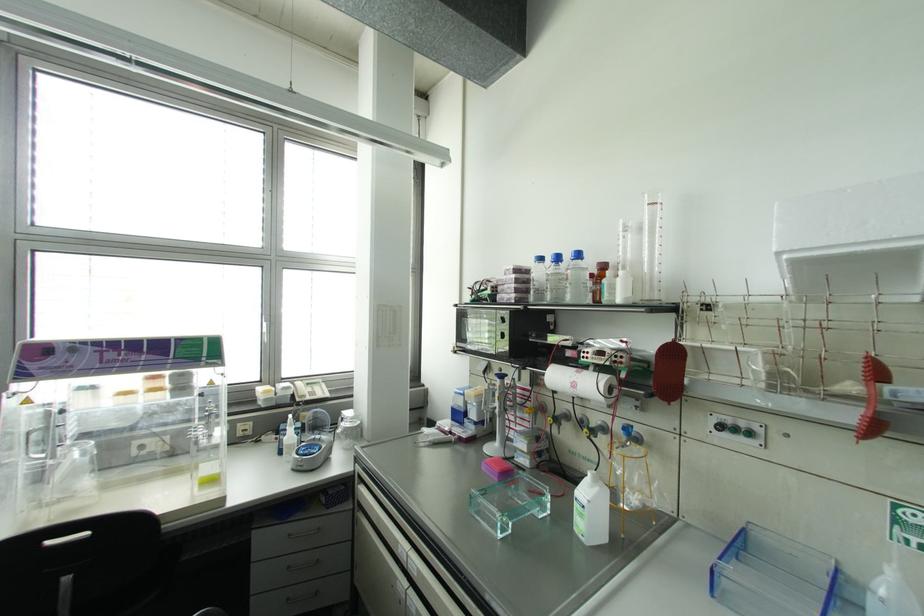
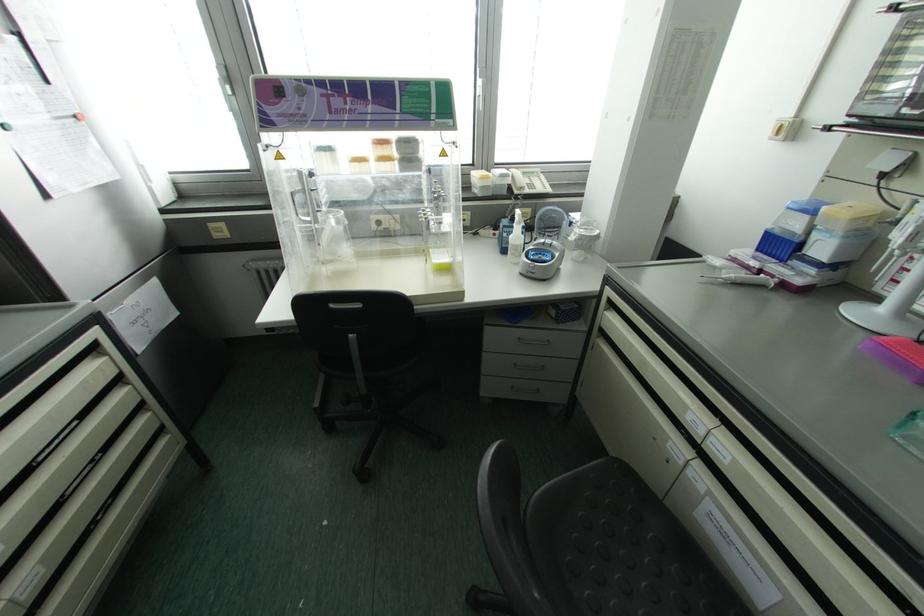
Where in the second image is the point corresponding to point (496, 443) from the first image?

(881, 309)